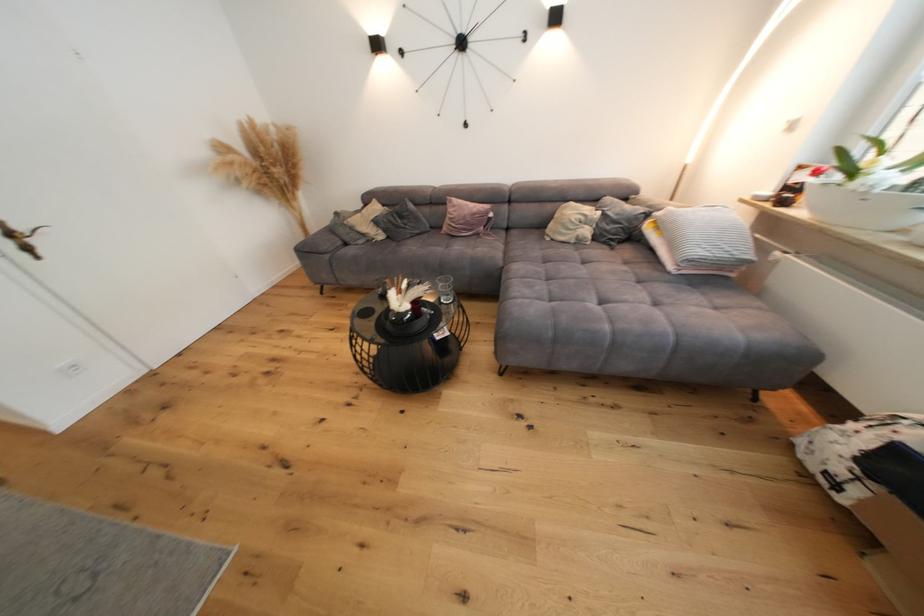
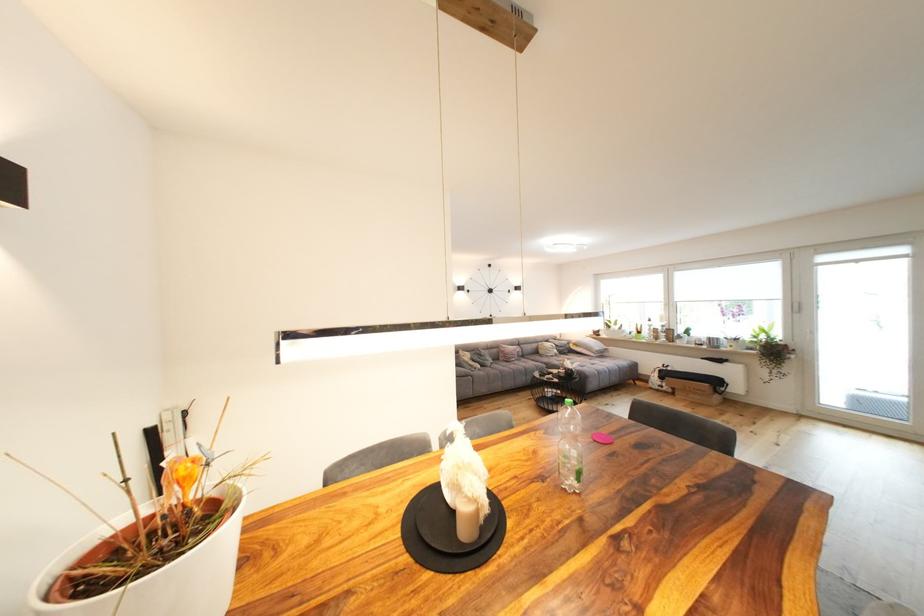
Where in the second image is the point corresponding to (593,233) from the first image?

(563, 353)